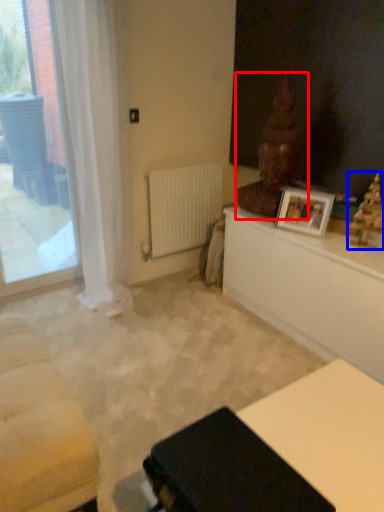
Question: Among these objects, which one is farthest to the camera, sculpture (highlighted by a red box) or sculpture (highlighted by a blue box)?

Choices:
 (A) sculpture
 (B) sculpture

Answer: (A)